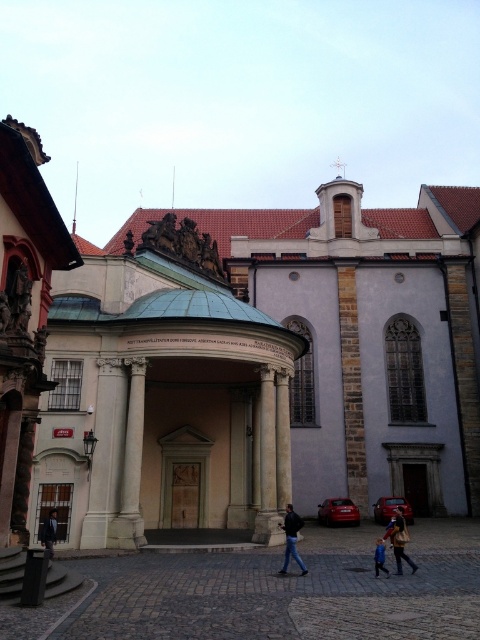
Question: Among these objects, which one is nearest to the camera?

Choices:
 (A) blue denim jeans at lower center
 (B) stone church at center

Answer: (B)

Question: Is stone church at center closer to camera compared to brown leather jacket at lower center?

Choices:
 (A) yes
 (B) no

Answer: (A)

Question: Among these objects, which one is nearest to the camera?

Choices:
 (A) blue denim jeans at lower center
 (B) stone church at center

Answer: (B)

Question: Does brown stone door at center have a greater width compared to dark blue suit at center?

Choices:
 (A) yes
 (B) no

Answer: (A)

Question: Can you confirm if dark brown wooden door at center is positioned to the right of brown leather jacket at lower center?

Choices:
 (A) no
 (B) yes

Answer: (B)

Question: Which point appears farthest from the camera in this image?

Choices:
 (A) (380, 550)
 (B) (197, 474)

Answer: (B)